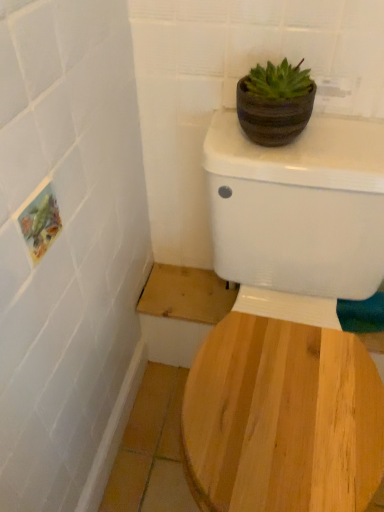
Question: Can you confirm if white glossy toilet at upper center is smaller than brown striped pot at upper right?

Choices:
 (A) no
 (B) yes

Answer: (A)

Question: Is white glossy toilet at upper center to the left of brown striped pot at upper right from the viewer's perspective?

Choices:
 (A) yes
 (B) no

Answer: (B)

Question: Does white glossy toilet at upper center have a greater height compared to brown striped pot at upper right?

Choices:
 (A) no
 (B) yes

Answer: (B)

Question: Can you confirm if white glossy toilet at upper center is bigger than brown striped pot at upper right?

Choices:
 (A) yes
 (B) no

Answer: (A)

Question: Is white glossy toilet at upper center located outside brown striped pot at upper right?

Choices:
 (A) yes
 (B) no

Answer: (A)

Question: From a real-world perspective, is white glossy toilet at upper center beneath brown striped pot at upper right?

Choices:
 (A) yes
 (B) no

Answer: (A)

Question: Is brown striped pot at upper right completely or partially outside of white glossy toilet at upper center?

Choices:
 (A) no
 (B) yes

Answer: (B)

Question: Does brown striped pot at upper right have a greater height compared to white glossy toilet at upper center?

Choices:
 (A) no
 (B) yes

Answer: (A)

Question: Can you confirm if brown striped pot at upper right is thinner than white glossy toilet at upper center?

Choices:
 (A) yes
 (B) no

Answer: (A)

Question: Would you consider brown striped pot at upper right to be distant from white glossy toilet at upper center?

Choices:
 (A) yes
 (B) no

Answer: (B)

Question: Does brown striped pot at upper right turn towards white glossy toilet at upper center?

Choices:
 (A) yes
 (B) no

Answer: (B)

Question: Could white glossy toilet at upper center be considered to be inside brown striped pot at upper right?

Choices:
 (A) no
 (B) yes

Answer: (A)

Question: Relative to brown striped pot at upper right, is white glossy toilet at upper center in front or behind?

Choices:
 (A) behind
 (B) front

Answer: (B)